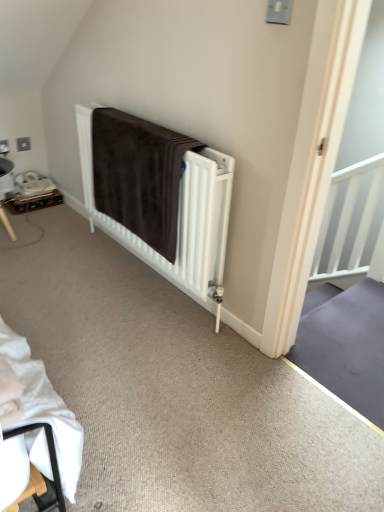
Question: Considering the relative positions of brown fabric bed at center and brown plush blanket at center in the image provided, is brown fabric bed at center in front of brown plush blanket at center?

Choices:
 (A) no
 (B) yes

Answer: (B)

Question: Is brown fabric bed at center placed right next to brown plush blanket at center?

Choices:
 (A) yes
 (B) no

Answer: (A)

Question: Is brown plush blanket at center completely or partially inside brown fabric bed at center?

Choices:
 (A) no
 (B) yes

Answer: (B)

Question: Can you confirm if brown fabric bed at center is shorter than brown plush blanket at center?

Choices:
 (A) yes
 (B) no

Answer: (B)

Question: From a real-world perspective, is brown fabric bed at center on top of brown plush blanket at center?

Choices:
 (A) yes
 (B) no

Answer: (B)

Question: Does brown fabric bed at center have a greater width compared to brown plush blanket at center?

Choices:
 (A) yes
 (B) no

Answer: (B)

Question: Considering the relative sizes of wooden tray at left and brown fabric bed at center in the image provided, is wooden tray at left shorter than brown fabric bed at center?

Choices:
 (A) no
 (B) yes

Answer: (B)

Question: Is wooden tray at left wider than brown fabric bed at center?

Choices:
 (A) yes
 (B) no

Answer: (A)

Question: Considering the relative sizes of wooden tray at left and brown fabric bed at center in the image provided, is wooden tray at left smaller than brown fabric bed at center?

Choices:
 (A) yes
 (B) no

Answer: (A)

Question: From the image's perspective, is wooden tray at left located beneath brown fabric bed at center?

Choices:
 (A) yes
 (B) no

Answer: (B)

Question: Is wooden tray at left not close to brown fabric bed at center?

Choices:
 (A) no
 (B) yes

Answer: (B)

Question: From the image's perspective, is wooden tray at left on brown fabric bed at center?

Choices:
 (A) yes
 (B) no

Answer: (A)

Question: Does wooden tray at left have a smaller size compared to brown plush blanket at center?

Choices:
 (A) yes
 (B) no

Answer: (A)